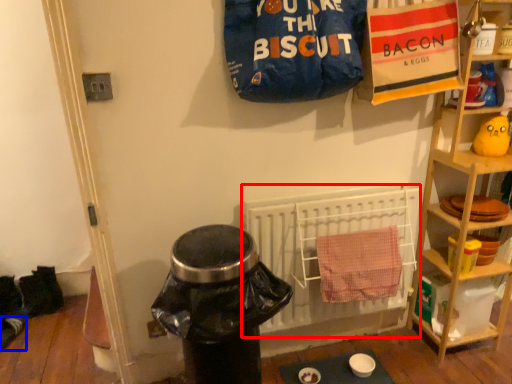
Question: Which of the following is the farthest to the observer, radiator (highlighted by a red box) or footwear (highlighted by a blue box)?

Choices:
 (A) radiator
 (B) footwear

Answer: (B)